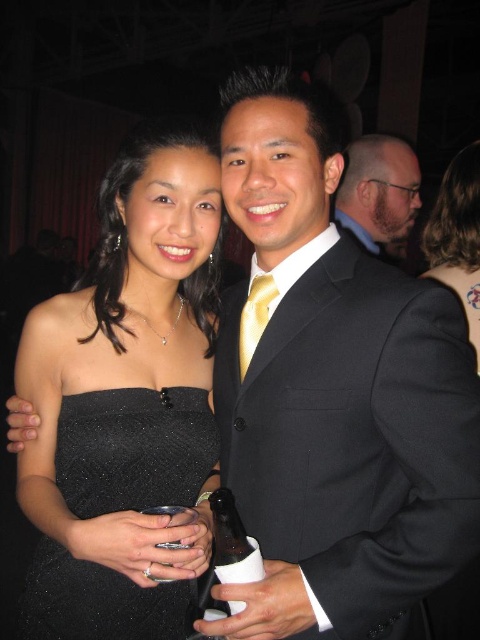
At what (x,y) coordinates should I click in order to perform the action: click on dark gray suit at center. Please return your answer as a coordinate pair (x, y). The height and width of the screenshot is (640, 480). Looking at the image, I should click on (379, 189).

Can you confirm if dark gray suit at center is positioned to the right of gold silk tie at center?

Indeed, dark gray suit at center is positioned on the right side of gold silk tie at center.

The height and width of the screenshot is (640, 480). Describe the element at coordinates (379, 189) in the screenshot. I see `dark gray suit at center` at that location.

The image size is (480, 640). Find the location of `dark gray suit at center`. dark gray suit at center is located at coordinates (379, 189).

Does dark gray suit at center come behind black satin dress at upper right?

Yes, dark gray suit at center is further from the viewer.

Can you confirm if dark gray suit at center is shorter than black satin dress at upper right?

Indeed, dark gray suit at center has a lesser height compared to black satin dress at upper right.

Locate an element on the screen. The width and height of the screenshot is (480, 640). dark gray suit at center is located at coordinates (379, 189).

Which is below, black satin dress at upper right or gold silk tie at center?

gold silk tie at center is below.

Between black satin dress at upper right and gold silk tie at center, which one is positioned higher?

black satin dress at upper right is above.

Does point (476, 339) come behind point (269, 301)?

Yes, it is.

You are a GUI agent. You are given a task and a screenshot of the screen. Output one action in this format:
    pyautogui.click(x=<x>, y=<y>)
    Task: Click on the black satin dress at upper right
    This screenshot has height=640, width=480.
    Given the screenshot: What is the action you would take?
    pyautogui.click(x=457, y=236)